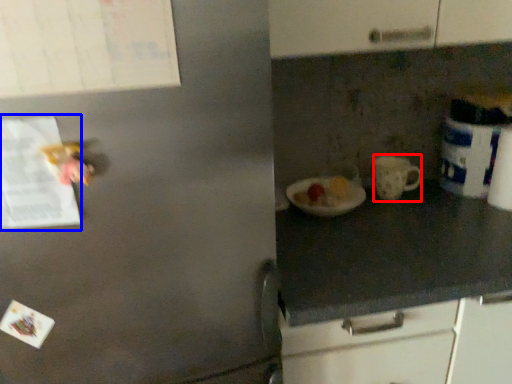
Question: Which point is closer to the camera, mug (highlighted by a red box) or paper (highlighted by a blue box)?

Choices:
 (A) mug
 (B) paper

Answer: (B)